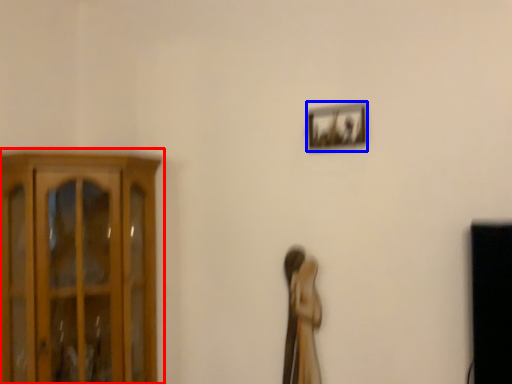
Question: Which point is closer to the camera, cupboard (highlighted by a red box) or picture frame (highlighted by a blue box)?

Choices:
 (A) cupboard
 (B) picture frame

Answer: (A)